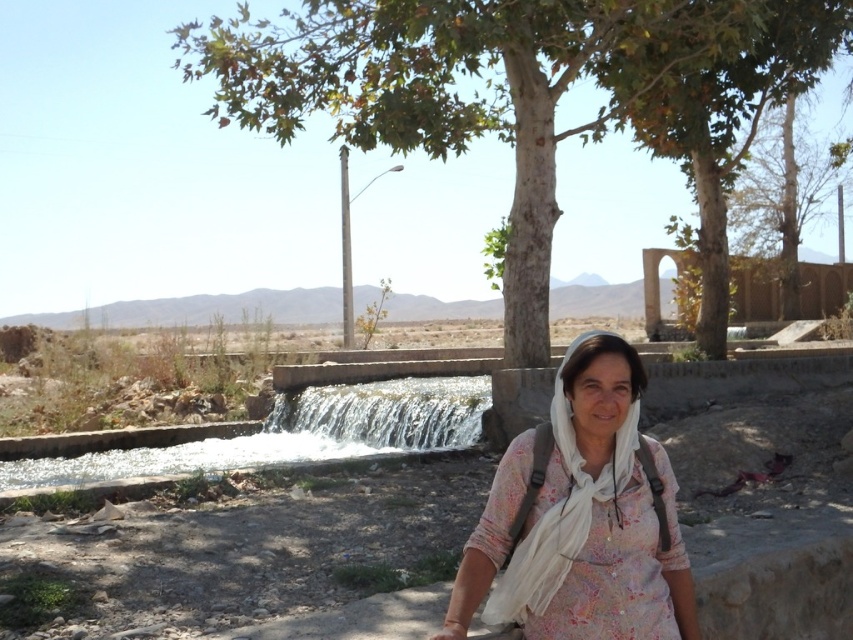
Which is more to the right, green leafy tree at center or clear water cascade at center?

green leafy tree at center

Does green leafy tree at center appear on the left side of clear water cascade at center?

No, green leafy tree at center is not to the left of clear water cascade at center.

Which is in front, point (508, 294) or point (296, 440)?

Point (508, 294) is more forward.

Locate an element on the screen. green leafy tree at center is located at coordinates (527, 97).

Between green leafy tree at center and white floral shirt at center, which one appears on the left side from the viewer's perspective?

green leafy tree at center

Which is in front, point (422, 150) or point (589, 380)?

Positioned in front is point (589, 380).

Which is behind, point (643, 144) or point (448, 608)?

The point (643, 144) is more distant.

Locate an element on the screen. This screenshot has width=853, height=640. green leafy tree at center is located at coordinates (527, 97).

Which of these two, white floral shirt at center or clear water cascade at center, stands shorter?

Standing shorter between the two is clear water cascade at center.

Who is more forward, (x=611, y=582) or (x=397, y=397)?

Point (x=611, y=582)

At what (x,y) coordinates should I click in order to perform the action: click on white floral shirt at center. Please return your answer as a coordinate pair (x, y). The width and height of the screenshot is (853, 640). Looking at the image, I should click on (598, 516).